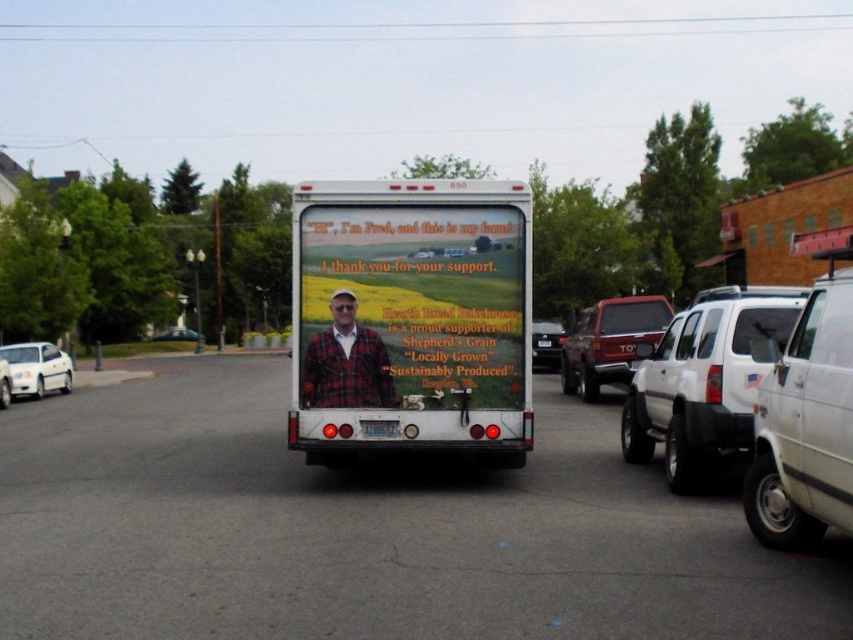
You are a pedestrian standing at the center of the street where the white delivery truck is parked. You want to cross the street to the sidewalk on the opposite side. The closest vehicle to you is either the white matte suv at right or the white glossy sedan at left. Which vehicle is closer to you?

The white glossy sedan at left is closer to you since it is positioned to the left of the white delivery truck, while the white matte suv at right is further away on the right side. Since you are at the center, the distance to the left vehicle is shorter.

You are a pedestrian standing on the sidewalk and see the plaid fabric man at center and the metallic silver sedan at center. Which object is closer to you?

The plaid fabric man at center is closer to you because it is positioned further to the viewer than the metallic silver sedan at center.